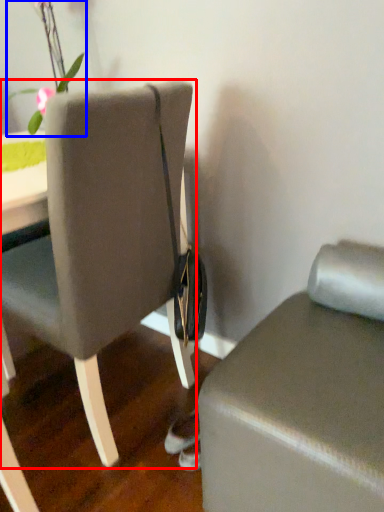
Question: Which object appears closest to the camera in this image, chair (highlighted by a red box) or floral arrangement (highlighted by a blue box)?

Choices:
 (A) chair
 (B) floral arrangement

Answer: (A)